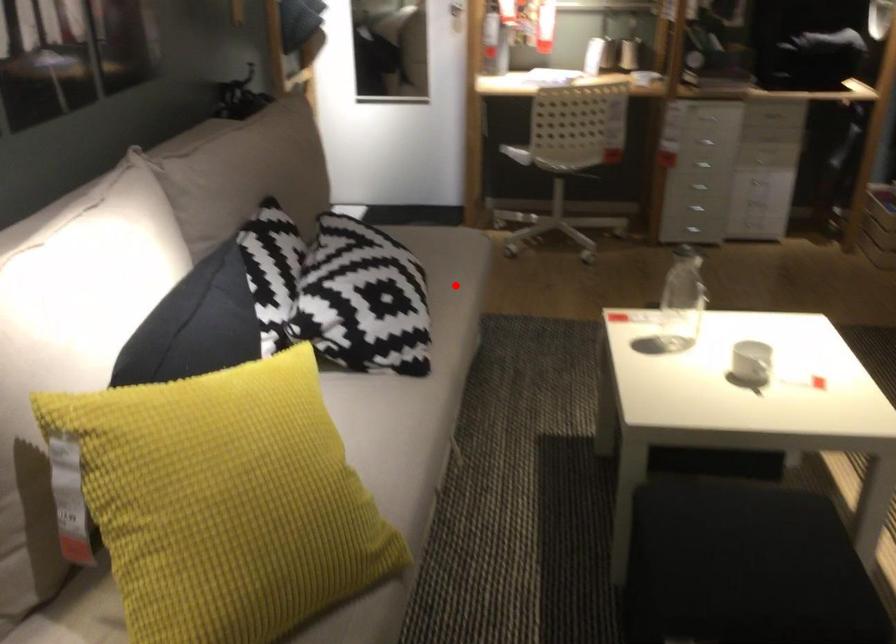
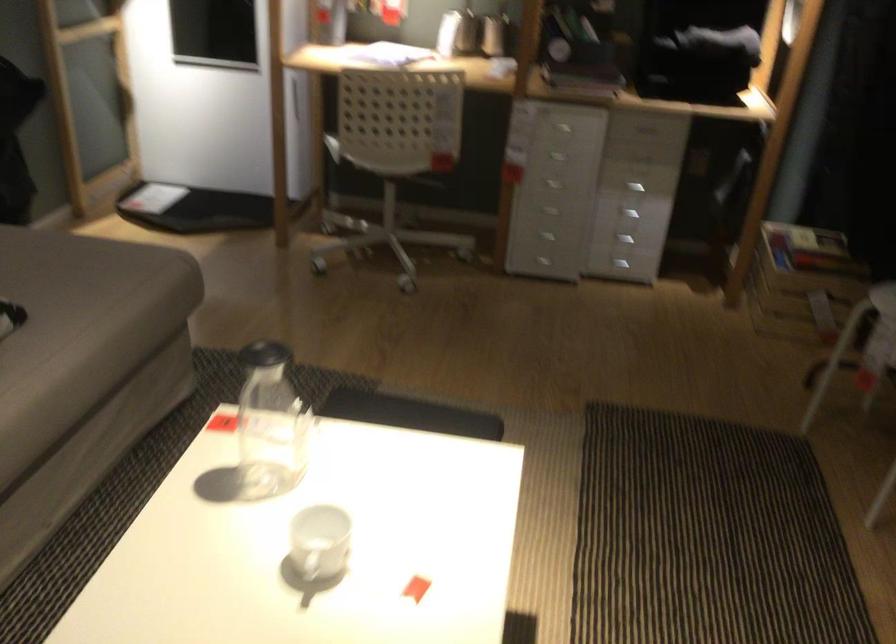
Locate, in the second image, the point that corresponds to the highlighted location in the first image.

(82, 324)